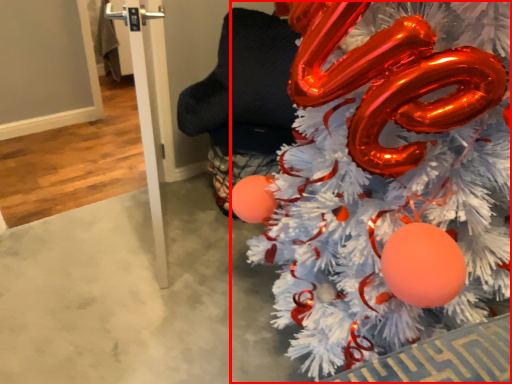
Question: From the image, what is the correct spatial relationship of christmas tree (annotated by the red box) in relation to pole?

Choices:
 (A) right
 (B) left

Answer: (A)